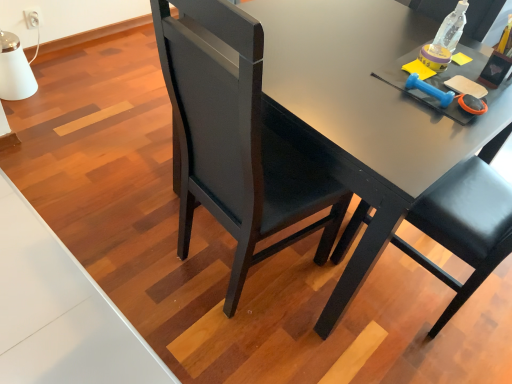
Identify the location of vacant location behind clear plastic bottle at upper right. This screenshot has width=512, height=384. (420, 21).